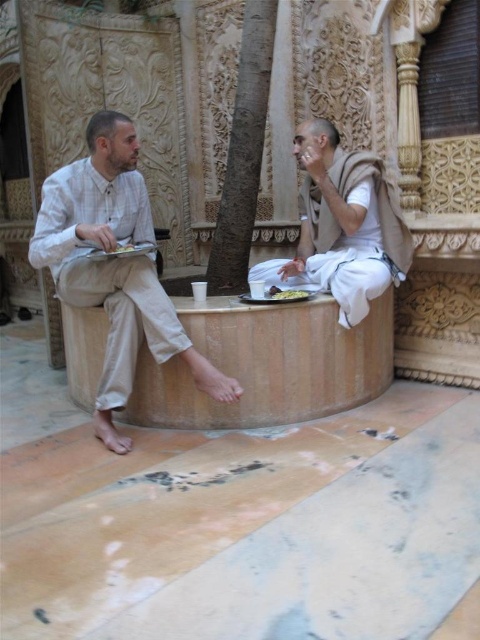
You are a photographer trying to capture the scene of the two individuals on the circular stone bench. You want to ensure that both the light beige cotton pants at left and the white cotton cloth at center are clearly visible in your photo. Given their heights, which object should you focus on first to ensure proper focus, and why?

The light beige cotton pants at left has a greater height compared to the white cotton cloth at center, so you should focus on the light beige cotton pants at left first since it is taller and might require more precise focusing to capture details.

You are standing in the courtyard and want to place a small statue between the two points, point (x=168, y=344) and point (x=383, y=262). Which point should the statue be closer to in order to be nearer to the viewer?

The statue should be closer to point (x=168, y=344) because it is nearer to the viewer compared to point (x=383, y=262).

You are standing in the courtyard and want to take a photo of the light beige cotton pants at left and the brown textured tree at center. Which object should you focus on first to ensure both are in clear view?

You should focus on the light beige cotton pants at left first because it is closer to the viewer than the brown textured tree at center, so focusing on the closer object will help both be in clear view.